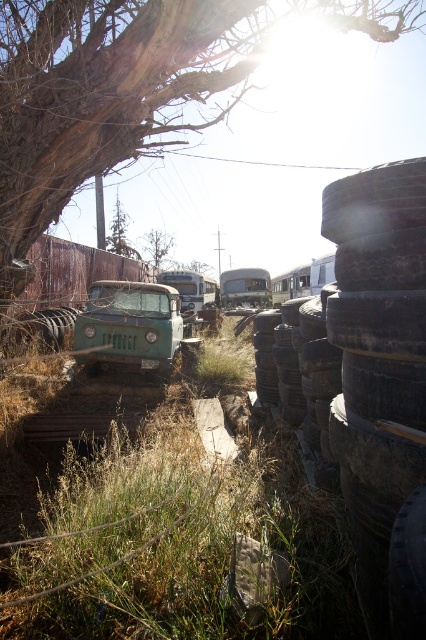
Question: Which of the following is the farthest from the observer?

Choices:
 (A) (198, 456)
 (B) (5, 179)
 (C) (408, 316)

Answer: (A)

Question: Does green grass at center come behind charcoal rubber tires at right?

Choices:
 (A) yes
 (B) no

Answer: (A)

Question: Based on their relative distances, which object is farther from the green grass at center?

Choices:
 (A) brown rough bark tree at upper left
 (B) brown rough tree at upper center

Answer: (B)

Question: Estimate the real-world distances between objects in this image. Which object is closer to the brown rough tree at upper center?

Choices:
 (A) charcoal rubber tires at right
 (B) green grass at center
 (C) metallic silver school bus at center

Answer: (C)

Question: Where is green matte truck at center located in relation to dark gray rubber tire at center in the image?

Choices:
 (A) below
 (B) above

Answer: (B)

Question: From the image, what is the correct spatial relationship of green grass at center in relation to green matte school bus at center?

Choices:
 (A) right
 (B) left

Answer: (B)